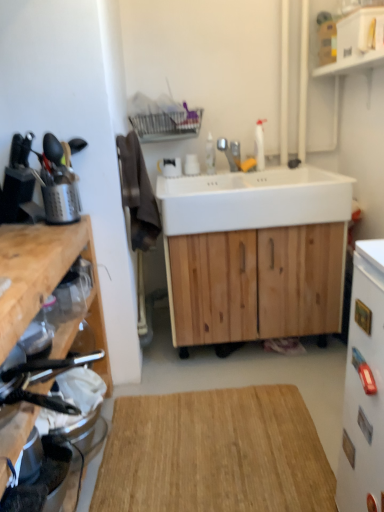
Find the location of `empty space that is ontop of natural wood cutting board at center (from a real-world perspective)`. empty space that is ontop of natural wood cutting board at center (from a real-world perspective) is located at coordinates (211, 443).